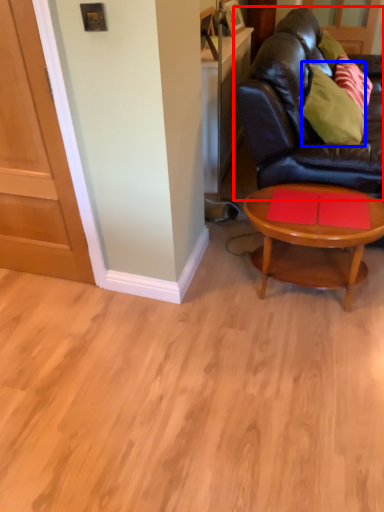
Question: Which of the following is the closest to the observer, studio couch (highlighted by a red box) or pillow (highlighted by a blue box)?

Choices:
 (A) studio couch
 (B) pillow

Answer: (A)